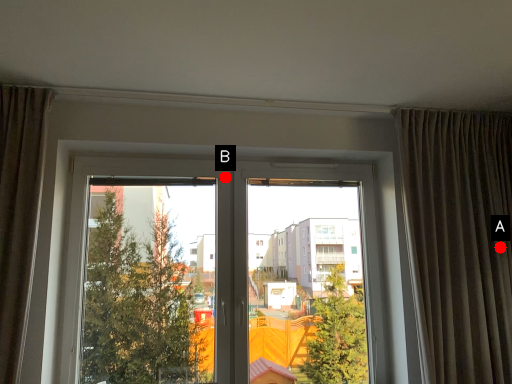
Question: Two points are circled on the image, labeled by A and B beside each circle. Among these points, which one is nearest to the camera?

Choices:
 (A) A is closer
 (B) B is closer

Answer: (A)